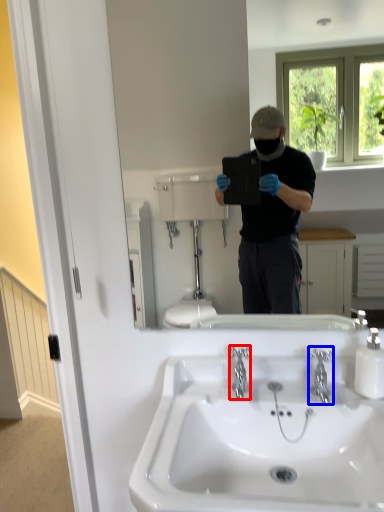
Question: Which object appears farthest to the camera in this image, plumbing fixture (highlighted by a red box) or plumbing fixture (highlighted by a blue box)?

Choices:
 (A) plumbing fixture
 (B) plumbing fixture

Answer: (A)